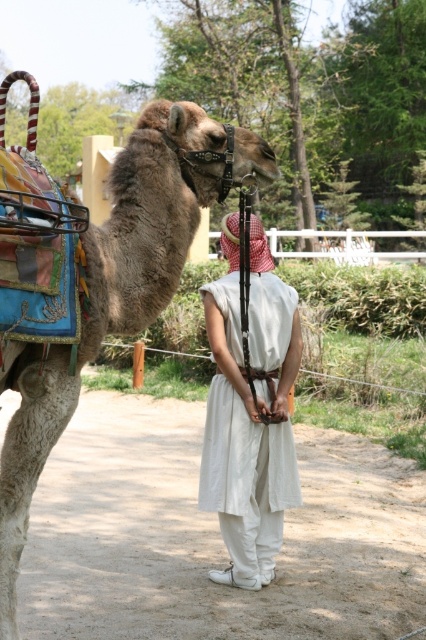
Question: Which of the following is the closest to the observer?

Choices:
 (A) fuzzy beige camel at center
 (B) white cotton dress at center

Answer: (A)

Question: Which object appears closest to the camera in this image?

Choices:
 (A) white cotton dress at center
 (B) fuzzy beige camel at center

Answer: (B)

Question: Does fuzzy beige camel at center appear on the right side of white cotton dress at center?

Choices:
 (A) no
 (B) yes

Answer: (A)

Question: Considering the relative positions of fuzzy beige camel at center and white cotton dress at center in the image provided, where is fuzzy beige camel at center located with respect to white cotton dress at center?

Choices:
 (A) above
 (B) below

Answer: (A)

Question: Which of the following is the farthest from the observer?

Choices:
 (A) white cotton dress at center
 (B) fuzzy beige camel at center

Answer: (A)

Question: Where is fuzzy beige camel at center located in relation to white cotton dress at center in the image?

Choices:
 (A) right
 (B) left

Answer: (B)